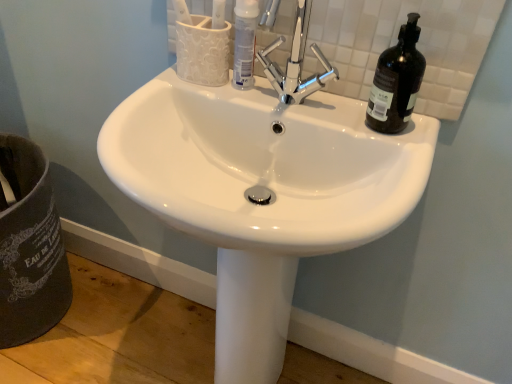
I want to click on vacant space positioned to the left of white glossy sink at center, so click(111, 326).